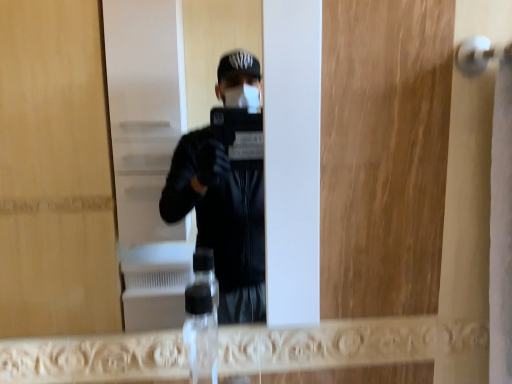
Measure the distance between transparent glass bottle at center and camera.

transparent glass bottle at center is 1.60 meters from camera.

The width and height of the screenshot is (512, 384). Describe the element at coordinates (200, 333) in the screenshot. I see `transparent glass bottle at center` at that location.

Measure the distance between point (215, 338) and camera.

The depth of point (215, 338) is 27.36 inches.

At what (x,y) coordinates should I click in order to perform the action: click on transparent glass bottle at center. Please return your answer as a coordinate pair (x, y). The height and width of the screenshot is (384, 512). Looking at the image, I should click on click(200, 333).

You are a GUI agent. You are given a task and a screenshot of the screen. Output one action in this format:
    pyautogui.click(x=<x>, y=<y>)
    Task: Click on the transparent glass bottle at center
    The width and height of the screenshot is (512, 384).
    Given the screenshot: What is the action you would take?
    pyautogui.click(x=200, y=333)